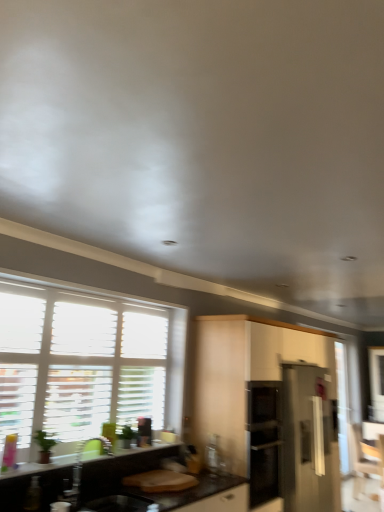
Question: Based on their positions, is stainless steel refrigerator at right located to the left or right of wooden armchair at lower right?

Choices:
 (A) right
 (B) left

Answer: (B)

Question: Considering their positions, is stainless steel refrigerator at right located in front of or behind wooden armchair at lower right?

Choices:
 (A) front
 (B) behind

Answer: (A)

Question: Which object is the farthest from the stainless steel refrigerator at right?

Choices:
 (A) satin white cabinet at center
 (B) black laminate countertop at lower left
 (C) wooden armchair at lower right
 (D) white wood window at left
 (E) black matte sink at lower left

Answer: (E)

Question: Considering the real-world distances, which object is closest to the stainless steel refrigerator at right?

Choices:
 (A) satin white cabinet at center
 (B) black matte sink at lower left
 (C) transparent glass screen door at right
 (D) wooden armchair at lower right
 (E) black laminate countertop at lower left

Answer: (A)